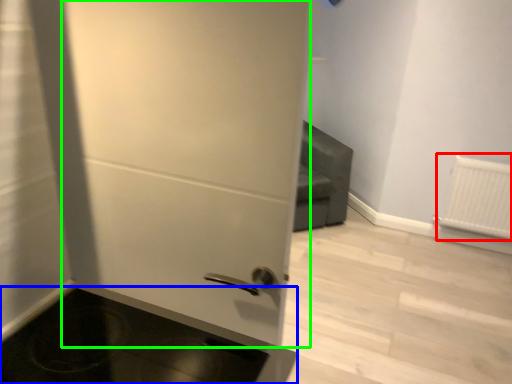
Question: Which is nearer to the radiator (highlighted by a red box)? appliance (highlighted by a blue box) or door (highlighted by a green box).

Choices:
 (A) appliance
 (B) door

Answer: (B)